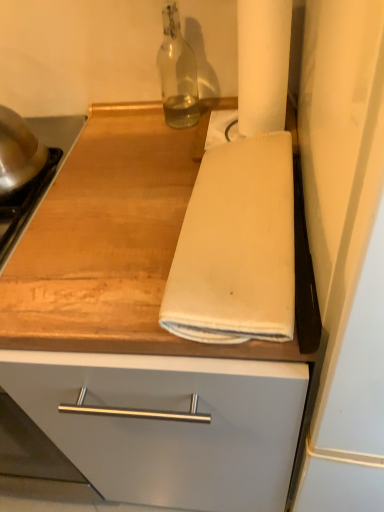
In order to click on free location in front of transparent glass bottle at upper center in this screenshot , I will do `click(168, 153)`.